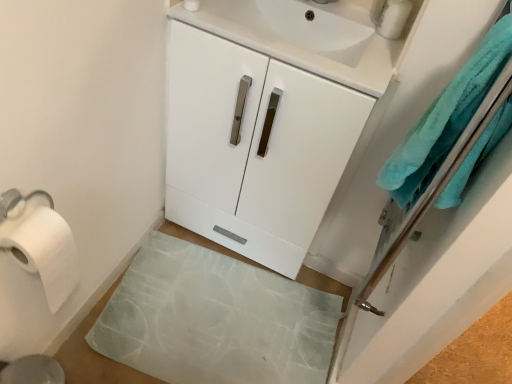
Question: Would you say white paper at left is to the left or to the right of white glossy sink at upper center in the picture?

Choices:
 (A) right
 (B) left

Answer: (B)

Question: Considering the positions of white paper at left and white glossy sink at upper center in the image, is white paper at left taller or shorter than white glossy sink at upper center?

Choices:
 (A) tall
 (B) short

Answer: (A)

Question: Estimate the real-world distances between objects in this image. Which object is farther from the white glossy cabinet at center?

Choices:
 (A) white paper at left
 (B) white glossy sink at upper center
 (C) translucent rubber bath mat at lower center
 (D) metallic silver soap dispenser at upper right
 (E) teal soft towel at right

Answer: (A)

Question: Which object is positioned closest to the metallic silver soap dispenser at upper right?

Choices:
 (A) teal soft towel at right
 (B) translucent rubber bath mat at lower center
 (C) white glossy cabinet at center
 (D) white paper at left
 (E) white glossy sink at upper center

Answer: (E)